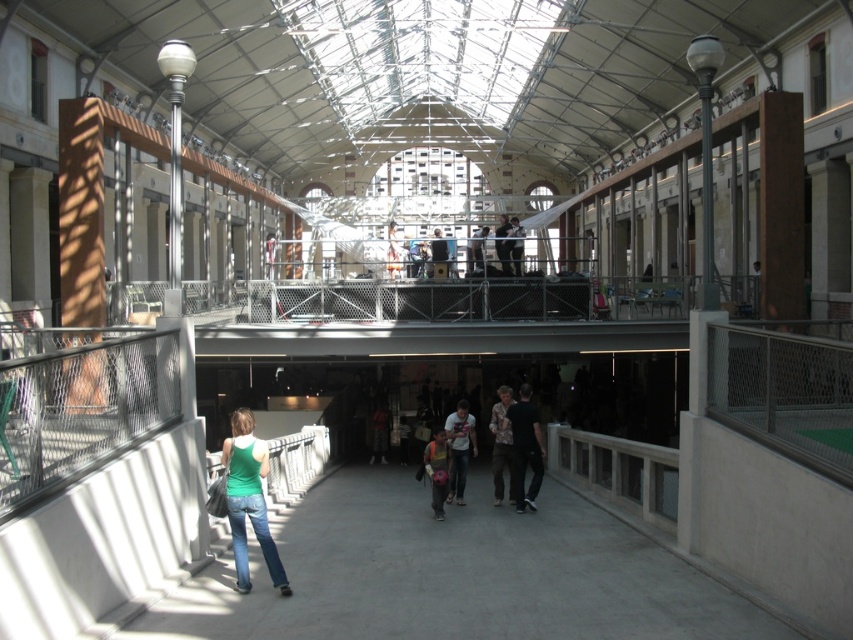
You are standing on the walkway in the atrium and see both the dark gray shirt at center and the light brown leather jacket at center. Which one is nearer to you?

The dark gray shirt at center is closer to the viewer than the light brown leather jacket at center.

You are standing at the viewer position in the atrium and want to reach point (x=473, y=496). If you can walk at 3 feet per second, how many seconds will it take you to reach there?

The distance between you and point (x=473, y=496) is 54.50 feet. At a walking speed of 3 feet per second, it will take approximately 18.17 seconds to reach there.

You are standing at the point labeled point (381,536) and want to walk to the point labeled point (500,461). Which direction should you move to get closer to your destination?

To move from point (381,536) to point (500,461), you should move downward since point (381,536) is closer to the viewer than point (500,461).